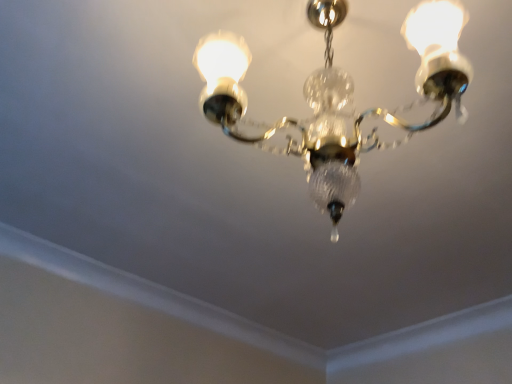
Image resolution: width=512 pixels, height=384 pixels. What do you see at coordinates (339, 97) in the screenshot?
I see `clear glass chandelier at center` at bounding box center [339, 97].

The height and width of the screenshot is (384, 512). Find the location of `clear glass chandelier at center`. clear glass chandelier at center is located at coordinates (339, 97).

Locate an element on the screen. Image resolution: width=512 pixels, height=384 pixels. clear glass chandelier at center is located at coordinates (339, 97).